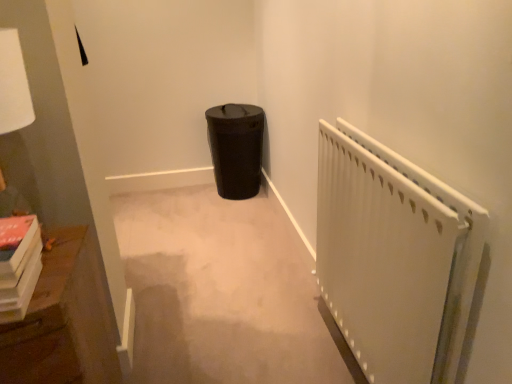
Question: Is wooden bookshelf at left wider or thinner than white matte radiator at right?

Choices:
 (A) thin
 (B) wide

Answer: (B)

Question: Is wooden bookshelf at left inside or outside of white matte radiator at right?

Choices:
 (A) outside
 (B) inside

Answer: (A)

Question: Which of these objects is positioned closest to the wooden bookshelf at left?

Choices:
 (A) black matte trash can at center
 (B) white matte radiator at right

Answer: (B)

Question: Estimate the real-world distances between objects in this image. Which object is closer to the white matte radiator at right?

Choices:
 (A) black matte trash can at center
 (B) wooden bookshelf at left

Answer: (B)